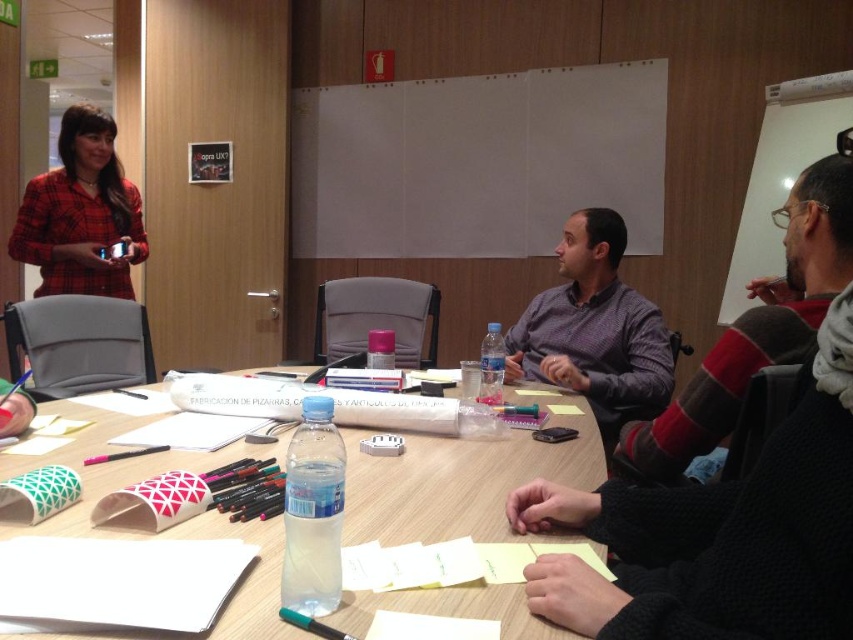
Question: Among these objects, which one is nearest to the camera?

Choices:
 (A) wooden table at center
 (B) red plaid shirt at upper left
 (C) striped sweater at right

Answer: (A)

Question: Does matte purple shirt at center come in front of red plaid shirt at upper left?

Choices:
 (A) no
 (B) yes

Answer: (B)

Question: Can you confirm if wooden table at center is smaller than striped sweater at right?

Choices:
 (A) no
 (B) yes

Answer: (B)

Question: Which is nearer to the wooden table at center?

Choices:
 (A) red plaid shirt at upper left
 (B) matte purple shirt at center

Answer: (B)

Question: Considering the relative positions of wooden table at center and striped sweater at right in the image provided, where is wooden table at center located with respect to striped sweater at right?

Choices:
 (A) right
 (B) left

Answer: (B)

Question: Among these objects, which one is farthest from the camera?

Choices:
 (A) wooden table at center
 (B) matte purple shirt at center

Answer: (B)